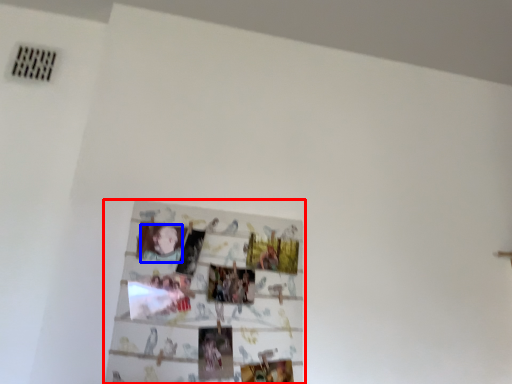
Question: Among these objects, which one is farthest to the camera, picture frame (highlighted by a red box) or person (highlighted by a blue box)?

Choices:
 (A) picture frame
 (B) person

Answer: (B)